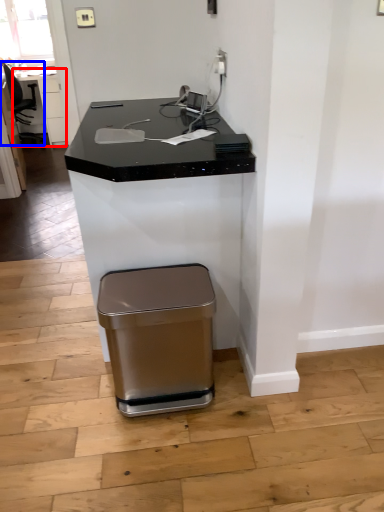
Question: Among these objects, which one is farthest to the camera, table (highlighted by a red box) or swivel chair (highlighted by a blue box)?

Choices:
 (A) table
 (B) swivel chair

Answer: (A)